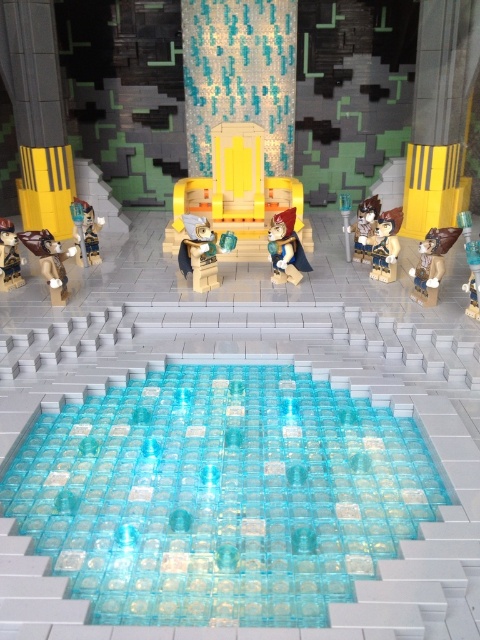
Question: Among these points, which one is nearest to the camera?

Choices:
 (A) (352, 259)
 (B) (388, 214)
 (C) (301, 252)

Answer: (C)

Question: Which of the following is the farthest from the observer?

Choices:
 (A) (457, 12)
 (B) (68, 250)

Answer: (A)

Question: Is matte brown armor at left smaller than satin gold armor at center?

Choices:
 (A) no
 (B) yes

Answer: (B)

Question: Does brown matte figure at center-right appear on the left side of matte brown minifigure at lower left?

Choices:
 (A) yes
 (B) no

Answer: (B)

Question: Does yellow matte pillar at right have a lesser width compared to yellow plastic chair at center?

Choices:
 (A) no
 (B) yes

Answer: (B)

Question: Which point is farther to the camera?

Choices:
 (A) yellow plastic chair at center
 (B) matte brown minifigure at lower left
 (C) brown matte minifigure at center-right

Answer: (A)